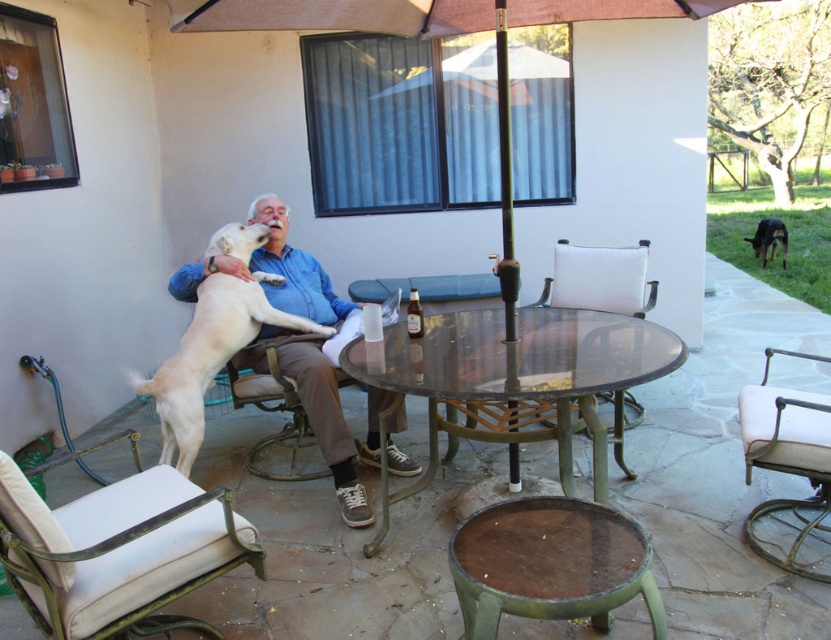
Question: Is light brown fur at upper left behind metallic silver chair at lower right?

Choices:
 (A) yes
 (B) no

Answer: (A)

Question: In this image, where is orange fabric umbrella at center located relative to white fabric chair at center?

Choices:
 (A) left
 (B) right

Answer: (B)

Question: Does light blue shirt at center have a smaller size compared to light brown fur at upper left?

Choices:
 (A) no
 (B) yes

Answer: (A)

Question: Which object is farther from the camera taking this photo?

Choices:
 (A) metallic silver chair at lower right
 (B) transparent glass table at center

Answer: (A)

Question: Which point is farther to the camera?

Choices:
 (A) metallic silver chair at lower right
 (B) black glossy dog at right
 (C) orange fabric umbrella at center
 (D) light brown fur at upper left

Answer: (B)

Question: Which point is farther from the camera taking this photo?

Choices:
 (A) (514, 374)
 (B) (510, 1)

Answer: (B)